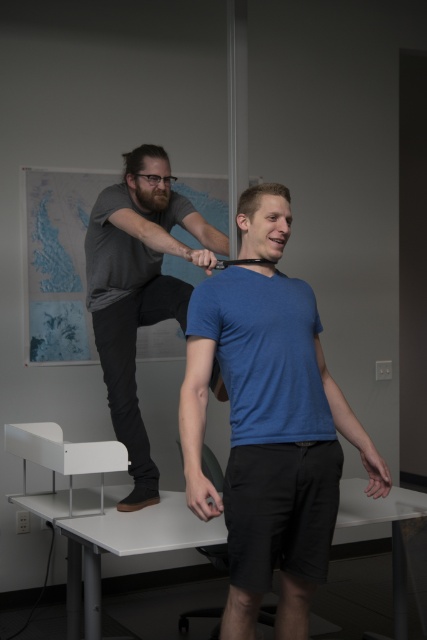
Question: Is blue matte shirt at center bigger than gray matte t-shirt at upper center?

Choices:
 (A) yes
 (B) no

Answer: (B)

Question: Is blue matte shirt at center wider than gray matte t-shirt at upper center?

Choices:
 (A) yes
 (B) no

Answer: (A)

Question: Does blue matte shirt at center appear on the left side of gray matte t-shirt at upper center?

Choices:
 (A) no
 (B) yes

Answer: (A)

Question: Which point is closer to the camera?

Choices:
 (A) blue matte shirt at center
 (B) gray matte t-shirt at upper center

Answer: (A)